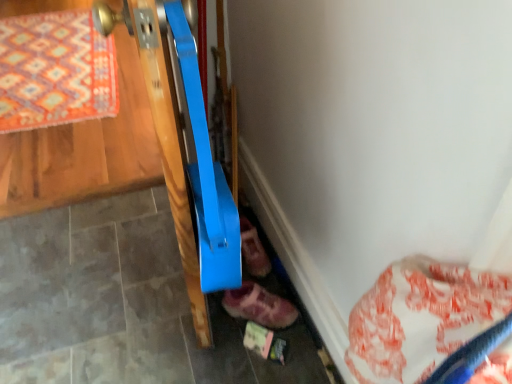
Question: Is leather pink shoe at lower center, acting as the 2th footwear starting from the front, taller than leather suede shoe at lower center, acting as the 2th footwear starting from the back?

Choices:
 (A) yes
 (B) no

Answer: (B)

Question: Can you confirm if leather pink shoe at lower center, acting as the 2th footwear starting from the front, is shorter than leather suede shoe at lower center, arranged as the first footwear when viewed from the front?

Choices:
 (A) no
 (B) yes

Answer: (B)

Question: From a real-world perspective, does leather pink shoe at lower center, which is the first footwear in back-to-front order, sit lower than leather suede shoe at lower center, acting as the 2th footwear starting from the back?

Choices:
 (A) yes
 (B) no

Answer: (B)

Question: Is leather pink shoe at lower center, acting as the 2th footwear starting from the front, at the left side of leather suede shoe at lower center, acting as the 2th footwear starting from the back?

Choices:
 (A) yes
 (B) no

Answer: (A)

Question: Is leather pink shoe at lower center, acting as the 2th footwear starting from the front, oriented towards leather suede shoe at lower center, arranged as the first footwear when viewed from the front?

Choices:
 (A) no
 (B) yes

Answer: (B)

Question: In the image, is leather suede shoe at lower center, acting as the 2th footwear starting from the back, positioned in front of or behind leather pink shoe at lower center, acting as the 2th footwear starting from the front?

Choices:
 (A) behind
 (B) front

Answer: (B)

Question: From their relative heights in the image, would you say leather suede shoe at lower center, arranged as the first footwear when viewed from the front, is taller or shorter than leather pink shoe at lower center, acting as the 2th footwear starting from the front?

Choices:
 (A) short
 (B) tall

Answer: (B)

Question: From a real-world perspective, is leather suede shoe at lower center, acting as the 2th footwear starting from the back, physically located above or below leather pink shoe at lower center, which is the first footwear in back-to-front order?

Choices:
 (A) above
 (B) below

Answer: (B)

Question: Would you say leather suede shoe at lower center, acting as the 2th footwear starting from the back, is to the left or to the right of leather pink shoe at lower center, acting as the 2th footwear starting from the front, in the picture?

Choices:
 (A) right
 (B) left

Answer: (A)

Question: Visually, is orange patterned rug at upper left positioned to the left or to the right of leather suede shoe at lower center, acting as the 2th footwear starting from the back?

Choices:
 (A) right
 (B) left

Answer: (B)

Question: From a real-world perspective, is orange patterned rug at upper left positioned above or below leather suede shoe at lower center, arranged as the first footwear when viewed from the front?

Choices:
 (A) above
 (B) below

Answer: (B)

Question: Considering the positions of orange patterned rug at upper left and leather suede shoe at lower center, acting as the 2th footwear starting from the back, in the image, is orange patterned rug at upper left taller or shorter than leather suede shoe at lower center, acting as the 2th footwear starting from the back,?

Choices:
 (A) short
 (B) tall

Answer: (A)

Question: Choose the correct answer: Is orange patterned rug at upper left inside leather suede shoe at lower center, acting as the 2th footwear starting from the back, or outside it?

Choices:
 (A) inside
 (B) outside

Answer: (B)

Question: From a real-world perspective, is orange patterned rug at upper left positioned above or below leather pink shoe at lower center, which is the first footwear in back-to-front order?

Choices:
 (A) above
 (B) below

Answer: (B)

Question: Is orange patterned rug at upper left in front of or behind leather pink shoe at lower center, which is the first footwear in back-to-front order, in the image?

Choices:
 (A) front
 (B) behind

Answer: (B)